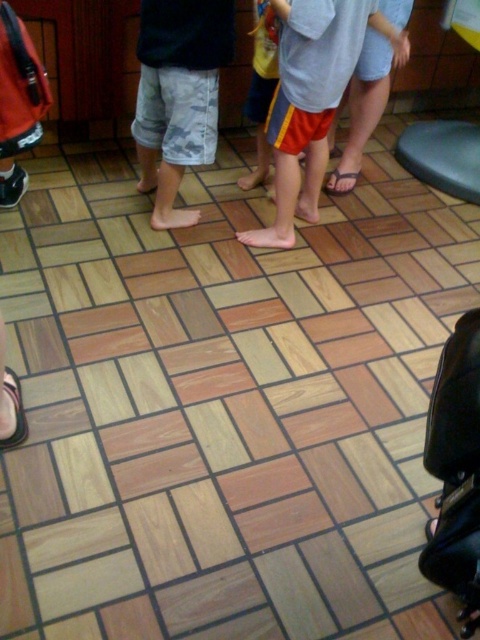
Question: Among these objects, which one is nearest to the camera?

Choices:
 (A) white rubber sandal at lower left
 (B) black plastic stool at lower right

Answer: (A)

Question: Which of these objects is positioned closest to the white rubber sandal at lower left?

Choices:
 (A) brown leather sandal at center
 (B) camouflage shorts at center
 (C) black plastic stool at lower right
 (D) matte red shorts at center

Answer: (B)

Question: Which of the following is the farthest from the observer?

Choices:
 (A) coord(352,177)
 (B) coord(328,124)
 (C) coord(423,164)
 (D) coord(351,184)

Answer: (C)

Question: Does matte red shorts at center come behind light blue denim shorts at center?

Choices:
 (A) yes
 (B) no

Answer: (B)

Question: Does camouflage shorts at center have a larger size compared to brown leather sandal at center?

Choices:
 (A) yes
 (B) no

Answer: (A)

Question: Does light blue denim shorts at center appear over black plastic stool at lower right?

Choices:
 (A) no
 (B) yes

Answer: (B)